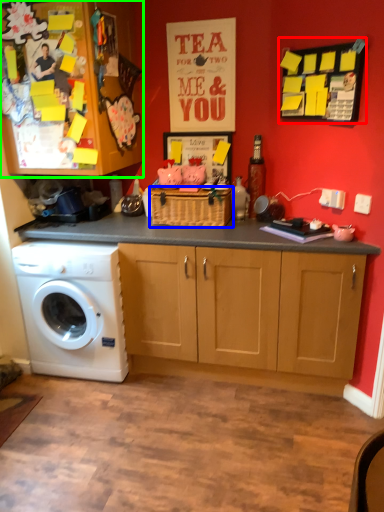
Question: Which is farther away from bulletin board (highlighted by a red box)? basket (highlighted by a blue box) or cabinetry (highlighted by a green box)?

Choices:
 (A) basket
 (B) cabinetry

Answer: (B)